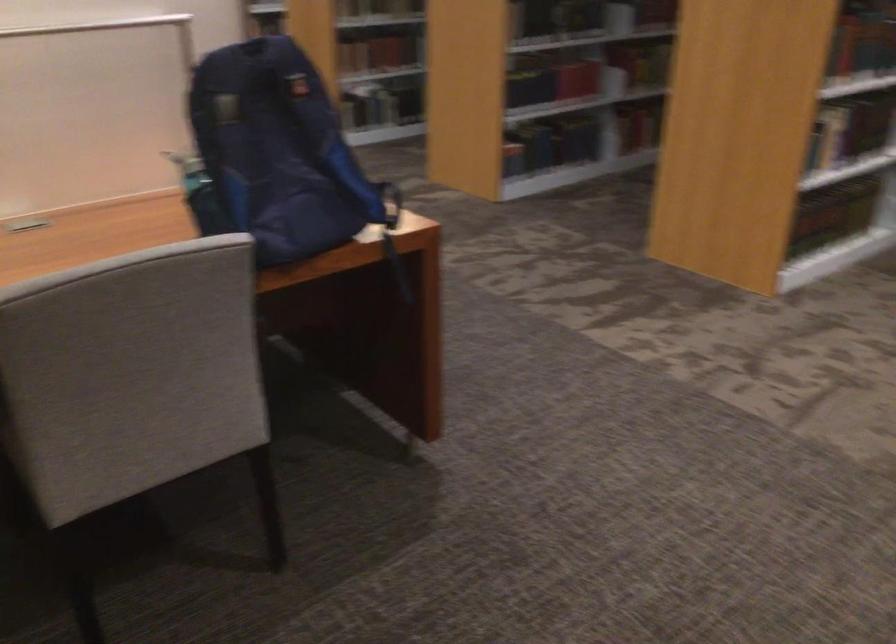
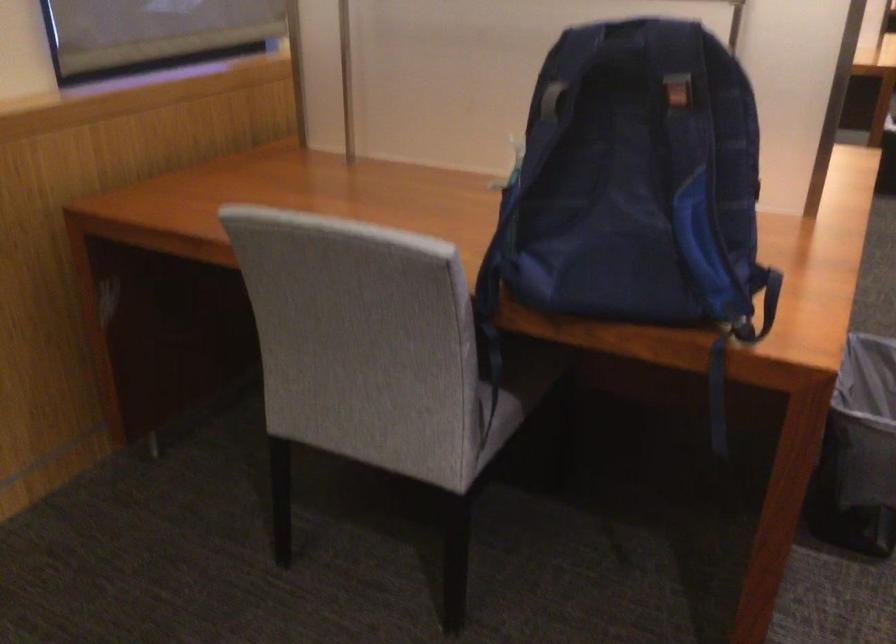
In the second image, find the point that corresponds to (304,87) in the first image.

(677, 93)